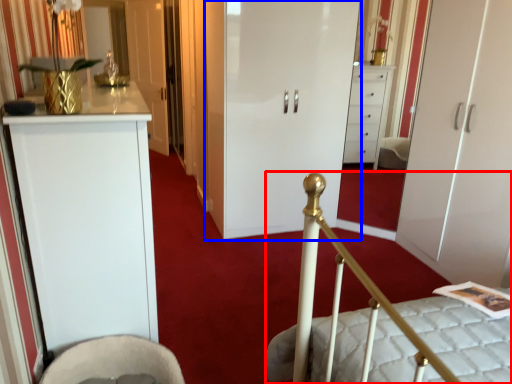
Question: Among these objects, which one is nearest to the camera, bed (highlighted by a red box) or door (highlighted by a blue box)?

Choices:
 (A) bed
 (B) door

Answer: (A)